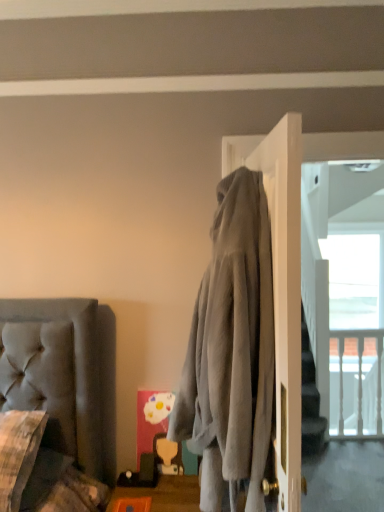
Question: From a real-world perspective, is orange plastic tray at lower center positioned above or below clear glass window at upper right?

Choices:
 (A) below
 (B) above

Answer: (A)

Question: Based on their sizes in the image, would you say orange plastic tray at lower center is bigger or smaller than clear glass window at upper right?

Choices:
 (A) big
 (B) small

Answer: (B)

Question: Which is nearer to the plush gray couch at lower left?

Choices:
 (A) gray fabric screen door at upper right
 (B) gray fleece hoodie at center
 (C) clear glass window at upper right
 (D) orange plastic tray at lower center

Answer: (D)

Question: Which is nearer to the clear glass window at upper right?

Choices:
 (A) plush gray couch at lower left
 (B) orange plastic tray at lower center
 (C) gray fleece hoodie at center
 (D) gray fabric screen door at upper right

Answer: (D)